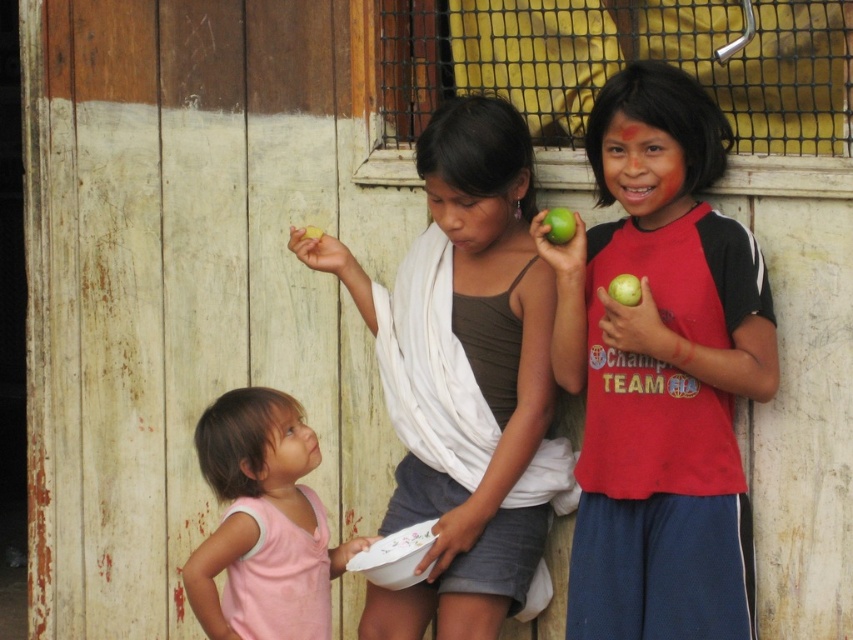
Is matte red shirt at center shorter than green matte apple at upper right?

No, matte red shirt at center is not shorter than green matte apple at upper right.

What do you see at coordinates (660, 371) in the screenshot? I see `matte red shirt at center` at bounding box center [660, 371].

Is point (675, 342) behind point (560, 228)?

No, (675, 342) is in front of (560, 228).

Locate an element on the screen. matte red shirt at center is located at coordinates (660, 371).

Who is more distant from viewer, (396, 506) or (210, 604)?

Point (396, 506)

Measure the distance between matte brown tank top at center and camera.

5.58 meters

Where is `matte brown tank top at center`? matte brown tank top at center is located at coordinates (x=463, y=376).

Is matte brown tank top at center above green matte apple at right?

Incorrect, matte brown tank top at center is not positioned above green matte apple at right.

Which is in front, point (422, 385) or point (640, 296)?

Point (640, 296) is more forward.

Does point (509, 394) lie in front of point (637, 294)?

No, it is not.

Image resolution: width=853 pixels, height=640 pixels. What are the coordinates of `matte brown tank top at center` in the screenshot? It's located at (463, 376).